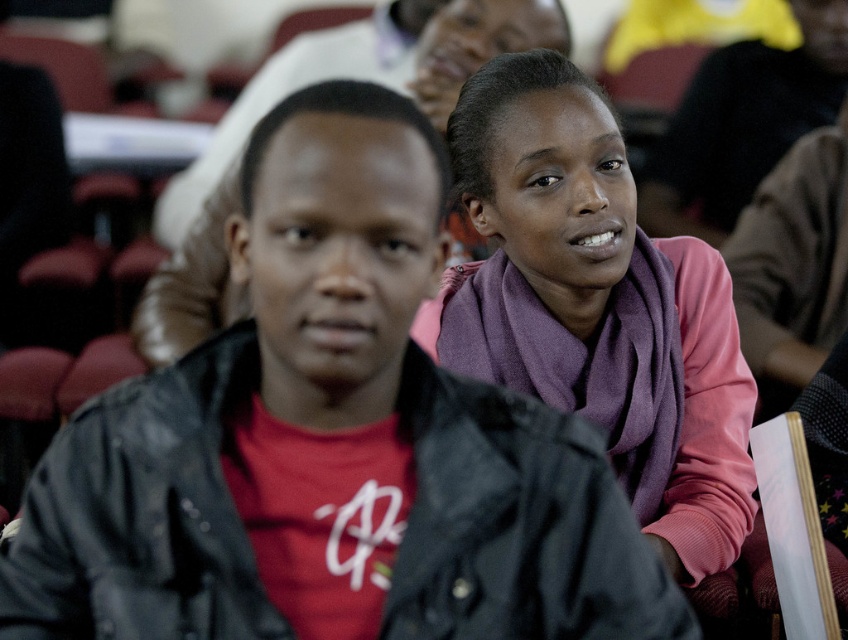
You are organizing a fashion show and need to arrange two purple scarves for a display. The purple scarf at upper right and the purple scarf at center are available. Which scarf should you choose if you want the longer one for the main showcase?

The purple scarf at center should be chosen for the main showcase because it is longer than the purple scarf at upper right according to the description.

You are an event photographer at a conference. You notice two purple scarves in the image. One is labeled as the purple scarf at upper right and the other as the purple scarf at center. From the photographer standing at the front, which scarf is positioned to the left?

The purple scarf at upper right is to the left of the purple scarf at center.